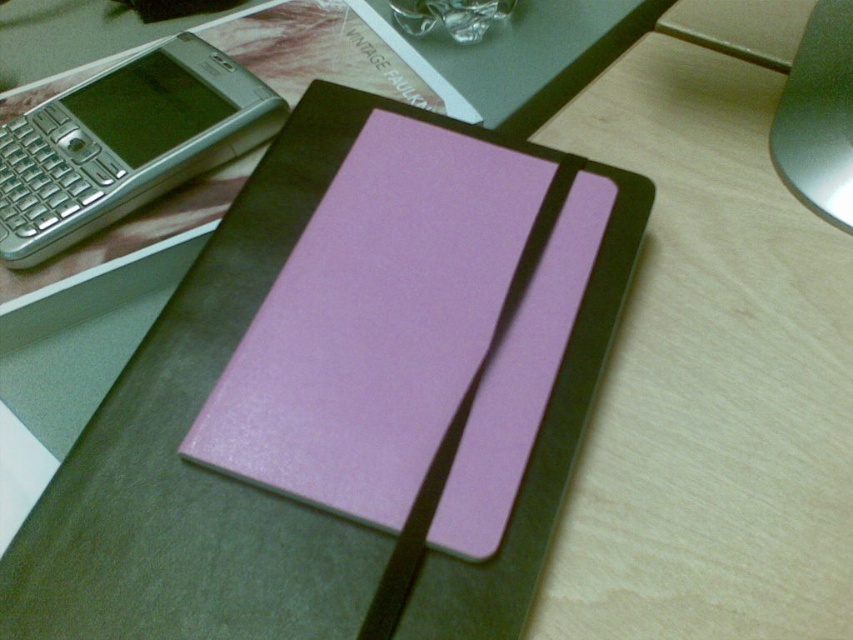
You are a photographer trying to capture a detailed image of the lavender matte notepad at center. You are currently positioned 12 inches away from the notepad. Do you need to move closer or farther away to ensure the notepad fills the frame properly?

The lavender matte notepad at center is 16.68 inches away from the camera. Since you are currently 12 inches away, you are closer than the required distance. To ensure the notepad fills the frame properly, you should move farther away to match the 16.68 inches distance.

You are organizing the desk items and need to place a lavender matte notepad at center. Where exactly should you position it relative to the other items?

The lavender matte notepad at center should be positioned at coordinates point (405, 336) as specified in the description.

You have a lavender matte notepad at center and a silver metallic smartphone at upper left on your desk. Which object has a greater width?

The lavender matte notepad at center has a greater width than the silver metallic smartphone at upper left.